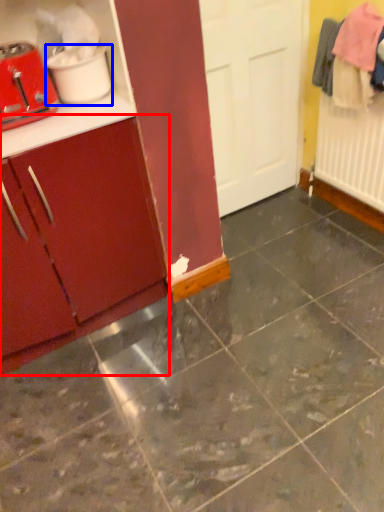
Question: Which of the following is the farthest to the observer, cabinetry (highlighted by a red box) or appliance (highlighted by a blue box)?

Choices:
 (A) cabinetry
 (B) appliance

Answer: (B)